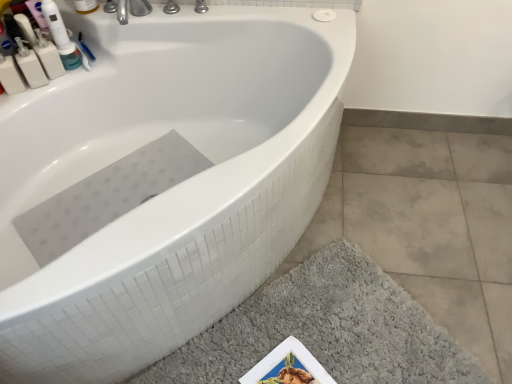
This screenshot has height=384, width=512. What do you see at coordinates (30, 65) in the screenshot?
I see `white plastic mouthwash at upper left, the 2th mouthwash viewed from the left` at bounding box center [30, 65].

Where is `gray shaggy bath mat at lower right`? The image size is (512, 384). gray shaggy bath mat at lower right is located at coordinates (326, 329).

This screenshot has width=512, height=384. Describe the element at coordinates (170, 188) in the screenshot. I see `white glossy bathtub at upper center` at that location.

The height and width of the screenshot is (384, 512). What are the coordinates of `white plastic mouthwash at upper left, the first mouthwash viewed from the right` in the screenshot? It's located at (85, 6).

Where is `gray rubber mat at lower left`? Image resolution: width=512 pixels, height=384 pixels. gray rubber mat at lower left is located at coordinates (106, 196).

Does white plastic bottle at upper left, the second mouthwash from the right, have a greater height compared to white plastic mouthwash at upper left, the 2th mouthwash viewed from the left?

No, white plastic bottle at upper left, the second mouthwash from the right, is not taller than white plastic mouthwash at upper left, the 2th mouthwash viewed from the left.

Considering the points (54, 56) and (27, 73), which point is behind, point (54, 56) or point (27, 73)?

The point (54, 56) is farther.

In the scene shown: How many degrees apart are the facing directions of white plastic bottle at upper left, which ranks as the 3th mouthwash in left-to-right order, and white plastic mouthwash at upper left, which appears as the third mouthwash when viewed from the right?

0.00527 degrees.

Looking at this image, from a real-world perspective, between white plastic bottle at upper left, the second mouthwash from the right, and white plastic mouthwash at upper left, the 2th mouthwash viewed from the left, who is vertically lower?

From a 3D spatial view, white plastic bottle at upper left, the second mouthwash from the right, is below.

From the picture: Choose the correct answer: Is white glossy bathtub at upper center inside white plastic mouthwash at upper left, the first mouthwash viewed from the right, or outside it?

white glossy bathtub at upper center is spatially situated outside white plastic mouthwash at upper left, the first mouthwash viewed from the right.

Is white glossy bathtub at upper center looking in the opposite direction of white plastic mouthwash at upper left, placed as the 4th mouthwash when sorted from left to right?

No, white glossy bathtub at upper center's orientation is not away from white plastic mouthwash at upper left, placed as the 4th mouthwash when sorted from left to right.

From the picture: From a real-world perspective, is white glossy bathtub at upper center located beneath white plastic mouthwash at upper left, the first mouthwash viewed from the right?

Yes, from a real-world perspective, white glossy bathtub at upper center is below white plastic mouthwash at upper left, the first mouthwash viewed from the right.

Is white plastic mouthwash at upper left, which is the 1th mouthwash from left to right, thinner than white plastic bottle at upper left, the second mouthwash from the right?

No, white plastic mouthwash at upper left, which is the 1th mouthwash from left to right, is not thinner than white plastic bottle at upper left, the second mouthwash from the right.

From a real-world perspective, relative to white plastic bottle at upper left, the second mouthwash from the right, is white plastic mouthwash at upper left, which is the 1th mouthwash from left to right, vertically above or below?

Clearly, from a real-world perspective, white plastic mouthwash at upper left, which is the 1th mouthwash from left to right, is above white plastic bottle at upper left, the second mouthwash from the right.

From the image's perspective, is white plastic mouthwash at upper left, which is the 1th mouthwash from left to right, beneath white plastic bottle at upper left, the second mouthwash from the right?

Yes, from the image's perspective, white plastic mouthwash at upper left, which is the 1th mouthwash from left to right, is beneath white plastic bottle at upper left, the second mouthwash from the right.

Considering the positions of points (16, 86) and (46, 69), is point (16, 86) farther from camera compared to point (46, 69)?

That is False.

This screenshot has width=512, height=384. What are the coordinates of `bath mat that appears below the white plastic bottle at upper left, which ranks as the 3th mouthwash in left-to-right order (from a real-world perspective)` in the screenshot? It's located at (326, 329).

Is white plastic bottle at upper left, which ranks as the 3th mouthwash in left-to-right order, outside of gray shaggy bath mat at lower right?

Indeed, white plastic bottle at upper left, which ranks as the 3th mouthwash in left-to-right order, is completely outside gray shaggy bath mat at lower right.

From a real-world perspective, is white plastic mouthwash at upper left, which is counted as the fourth mouthwash, starting from the right, positioned over gray shaggy bath mat at lower right based on gravity?

Yes.

From the picture: Can you confirm if white plastic mouthwash at upper left, which is counted as the fourth mouthwash, starting from the right, is wider than gray shaggy bath mat at lower right?

Incorrect, the width of white plastic mouthwash at upper left, which is counted as the fourth mouthwash, starting from the right, does not surpass that of gray shaggy bath mat at lower right.

Which of these two, white plastic mouthwash at upper left, which is counted as the fourth mouthwash, starting from the right, or gray shaggy bath mat at lower right, is smaller?

With smaller size is white plastic mouthwash at upper left, which is counted as the fourth mouthwash, starting from the right.

Is white plastic mouthwash at upper left, which is counted as the fourth mouthwash, starting from the right, far from gray shaggy bath mat at lower right?

Yes, white plastic mouthwash at upper left, which is counted as the fourth mouthwash, starting from the right, and gray shaggy bath mat at lower right are located far from each other.

Between gray shaggy bath mat at lower right and white plastic mouthwash at upper left, which is the 1th mouthwash from left to right, which one has larger width?

With larger width is gray shaggy bath mat at lower right.

I want to click on the 4th mouthwash to the left of the gray shaggy bath mat at lower right, starting your count from the anchor, so click(10, 76).

From a real-world perspective, is gray shaggy bath mat at lower right physically below white plastic mouthwash at upper left, which is counted as the fourth mouthwash, starting from the right?

Yes.

Consider the image. How much distance is there between gray shaggy bath mat at lower right and white plastic mouthwash at upper left, which is the 1th mouthwash from left to right?

gray shaggy bath mat at lower right and white plastic mouthwash at upper left, which is the 1th mouthwash from left to right, are 1.32 meters apart from each other.

Looking at this image, can you confirm if white plastic mouthwash at upper left, the 2th mouthwash viewed from the left, is bigger than white plastic mouthwash at upper left, placed as the 4th mouthwash when sorted from left to right?

Indeed, white plastic mouthwash at upper left, the 2th mouthwash viewed from the left, has a larger size compared to white plastic mouthwash at upper left, placed as the 4th mouthwash when sorted from left to right.

Is point (34, 79) closer to camera compared to point (85, 9)?

Yes, it is in front of point (85, 9).

Is white plastic mouthwash at upper left, which appears as the third mouthwash when viewed from the right, positioned in front of white plastic mouthwash at upper left, the first mouthwash viewed from the right?

Yes, it is in front of white plastic mouthwash at upper left, the first mouthwash viewed from the right.

Is white plastic mouthwash at upper left, the first mouthwash viewed from the right, completely or partially inside white plastic mouthwash at upper left, which appears as the third mouthwash when viewed from the right?

No, white plastic mouthwash at upper left, the first mouthwash viewed from the right, is not a part of white plastic mouthwash at upper left, which appears as the third mouthwash when viewed from the right.

Identify the location of the 1st mouthwash counting from the left of the white plastic bottle at upper left, which ranks as the 3th mouthwash in left-to-right order. (30, 65).

Where is `the 3rd mouthwash behind the white glossy bathtub at upper center`? the 3rd mouthwash behind the white glossy bathtub at upper center is located at coordinates (85, 6).

Based on their spatial positions, is white glossy bathtub at upper center or gray shaggy bath mat at lower right closer to white plastic mouthwash at upper left, which appears as the third mouthwash when viewed from the right?

white glossy bathtub at upper center lies closer to white plastic mouthwash at upper left, which appears as the third mouthwash when viewed from the right, than the other object.

When comparing their distances from gray rubber mat at lower left, does white plastic bottle at upper left, which ranks as the 3th mouthwash in left-to-right order, or white plastic mouthwash at upper left, placed as the 4th mouthwash when sorted from left to right, seem closer?

white plastic bottle at upper left, which ranks as the 3th mouthwash in left-to-right order.

Which object lies nearer to the anchor point white plastic mouthwash at upper left, which is the 1th mouthwash from left to right, gray rubber mat at lower left or white plastic bottle at upper left, the second mouthwash from the right?

Based on the image, white plastic bottle at upper left, the second mouthwash from the right, appears to be nearer to white plastic mouthwash at upper left, which is the 1th mouthwash from left to right.

Which object lies nearer to the anchor point white plastic bottle at upper left, which ranks as the 3th mouthwash in left-to-right order, white plastic mouthwash at upper left, the first mouthwash viewed from the right, or white glossy bathtub at upper center?

white plastic mouthwash at upper left, the first mouthwash viewed from the right, is closer to white plastic bottle at upper left, which ranks as the 3th mouthwash in left-to-right order.

Estimate the real-world distances between objects in this image. Which object is closer to white plastic bottle at upper left, which ranks as the 3th mouthwash in left-to-right order, white plastic mouthwash at upper left, the 2th mouthwash viewed from the left, or gray shaggy bath mat at lower right?

white plastic mouthwash at upper left, the 2th mouthwash viewed from the left, is closer to white plastic bottle at upper left, which ranks as the 3th mouthwash in left-to-right order.

Estimate the real-world distances between objects in this image. Which object is further from white glossy bathtub at upper center, white plastic mouthwash at upper left, which appears as the third mouthwash when viewed from the right, or white plastic bottle at upper left, which ranks as the 3th mouthwash in left-to-right order?

white plastic mouthwash at upper left, which appears as the third mouthwash when viewed from the right.

Estimate the real-world distances between objects in this image. Which object is closer to gray rubber mat at lower left, white plastic mouthwash at upper left, which is counted as the fourth mouthwash, starting from the right, or white plastic mouthwash at upper left, which appears as the third mouthwash when viewed from the right?

Among the two, white plastic mouthwash at upper left, which appears as the third mouthwash when viewed from the right, is located nearer to gray rubber mat at lower left.

Based on their spatial positions, is gray rubber mat at lower left or white plastic mouthwash at upper left, which is the 1th mouthwash from left to right, further from white plastic mouthwash at upper left, the first mouthwash viewed from the right?

gray rubber mat at lower left.

You are a GUI agent. You are given a task and a screenshot of the screen. Output one action in this format:
    pyautogui.click(x=<x>, y=<y>)
    Task: Click on the bathtub between white plastic mouthwash at upper left, which appears as the third mouthwash when viewed from the right, and gray shaggy bath mat at lower right from top to bottom
    The width and height of the screenshot is (512, 384).
    Given the screenshot: What is the action you would take?
    pyautogui.click(x=170, y=188)

Where is `bath towel between white plastic mouthwash at upper left, which is counted as the fourth mouthwash, starting from the right, and gray shaggy bath mat at lower right from left to right`? This screenshot has width=512, height=384. bath towel between white plastic mouthwash at upper left, which is counted as the fourth mouthwash, starting from the right, and gray shaggy bath mat at lower right from left to right is located at coordinates (106, 196).

Locate an element on the screen. The width and height of the screenshot is (512, 384). bath mat between white glossy bathtub at upper center and gray rubber mat at lower left in the front-back direction is located at coordinates (326, 329).

The image size is (512, 384). What are the coordinates of `mouthwash between white plastic mouthwash at upper left, placed as the 4th mouthwash when sorted from left to right, and white plastic mouthwash at upper left, which appears as the third mouthwash when viewed from the right, from top to bottom` in the screenshot? It's located at (48, 56).